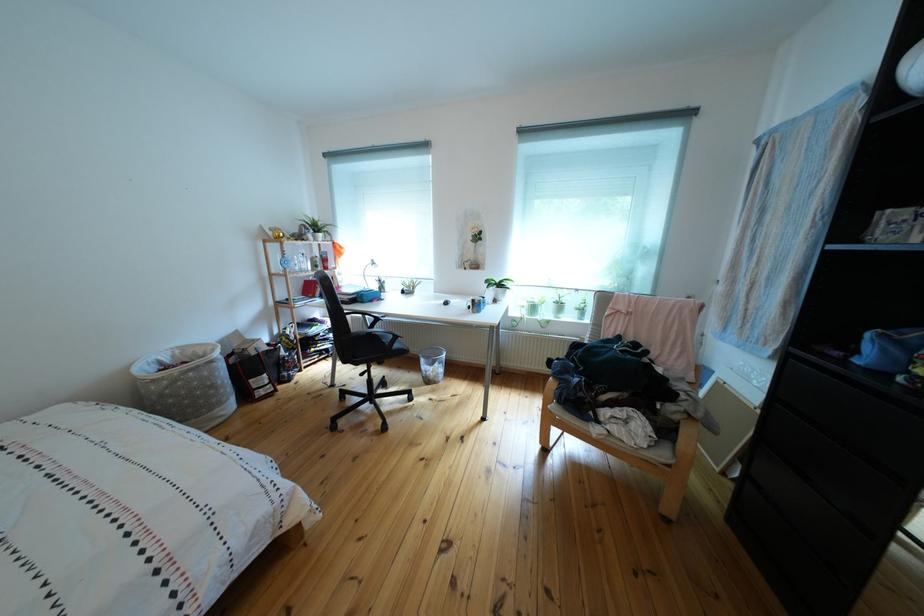
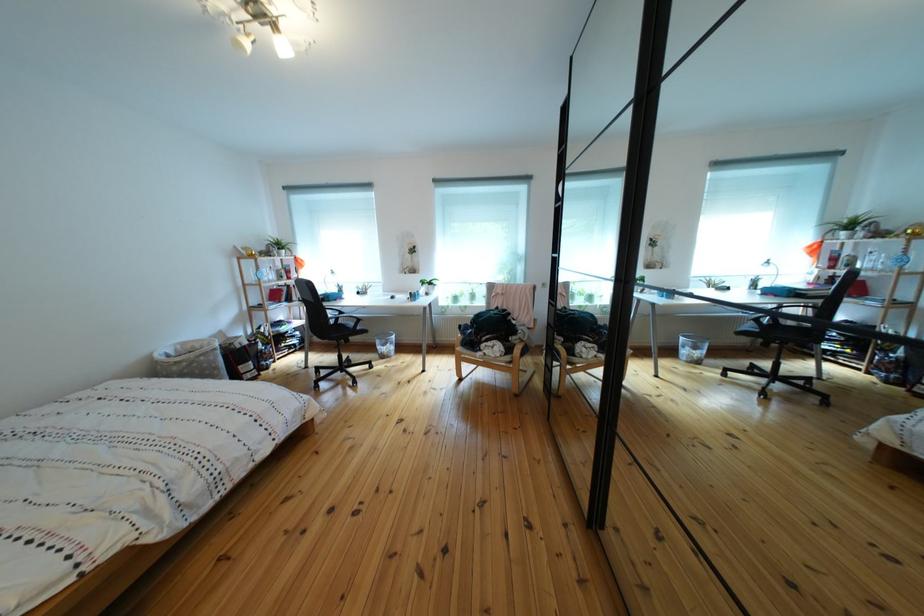
Find the pixel in the second image that matches pixel 373 309 in the first image.

(341, 307)